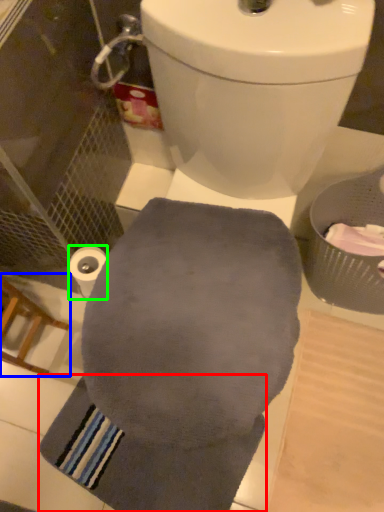
Question: Which is nearer to the bath towel (highlighted by a red box)? chair (highlighted by a blue box) or toilet paper (highlighted by a green box).

Choices:
 (A) chair
 (B) toilet paper

Answer: (A)